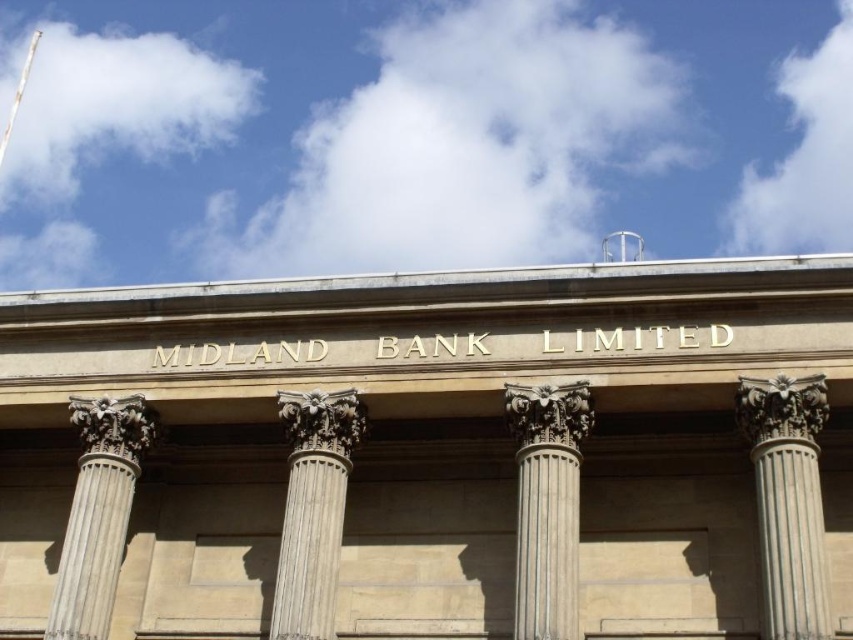
Consider the image. You are standing in front of the building and notice two columns, the gray stone column at center and the white stone column at left. Which one is positioned more to the left side of the building?

The white stone column at left is positioned more to the left side of the building.

Looking at this image, based on the scene of the classical building with columns, if you are standing in front of the building facing it, which column is positioned to the right side when comparing the white marble column at center and the white stone column at left?

The white marble column at center is positioned to the right of the white stone column at left.

You are standing in front of the building and notice the white stone column at right and the gray stone column at center. Which column is positioned lower in the structure?

The white stone column at right is located below the gray stone column at center, so it is positioned lower in the structure.